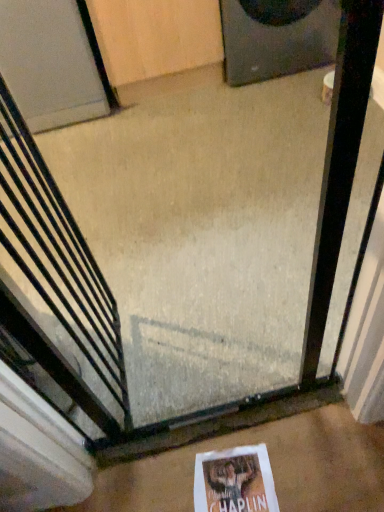
Question: Considering the positions of white matte door at upper left and black matte speaker at upper right in the image, is white matte door at upper left taller or shorter than black matte speaker at upper right?

Choices:
 (A) tall
 (B) short

Answer: (A)

Question: Based on their positions, is white matte door at upper left located to the left or right of black matte speaker at upper right?

Choices:
 (A) right
 (B) left

Answer: (B)

Question: Which object is positioned farthest from the black metal escalator at center?

Choices:
 (A) black matte speaker at upper right
 (B) white matte door at upper left
 (C) white concrete at center
 (D) white paper at lower center

Answer: (A)

Question: Which is farther from the black matte speaker at upper right?

Choices:
 (A) black metal escalator at center
 (B) white paper at lower center
 (C) white concrete at center
 (D) white matte door at upper left

Answer: (B)